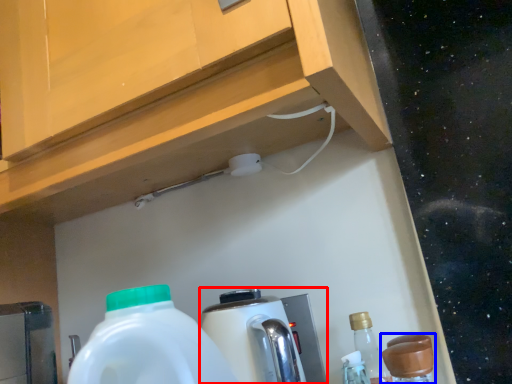
Question: Which object appears closest to the camera in this image, coffee machine (highlighted by a red box) or bottle (highlighted by a blue box)?

Choices:
 (A) coffee machine
 (B) bottle

Answer: (B)